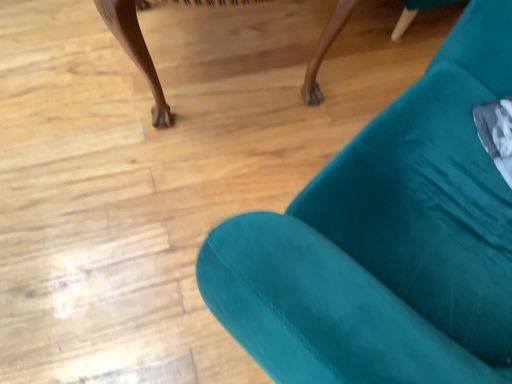
Question: Based on their sizes in the image, would you say velvet teal armchair at upper right is bigger or smaller than teal fabric chair at lower right?

Choices:
 (A) big
 (B) small

Answer: (A)

Question: Is velvet teal armchair at upper right in front of or behind teal fabric chair at lower right in the image?

Choices:
 (A) front
 (B) behind

Answer: (A)

Question: Is point (498, 345) closer or farther from the camera than point (160, 89)?

Choices:
 (A) farther
 (B) closer

Answer: (B)

Question: Considering the positions of teal fabric chair at lower right and velvet teal armchair at upper right in the image, is teal fabric chair at lower right wider or thinner than velvet teal armchair at upper right?

Choices:
 (A) thin
 (B) wide

Answer: (B)

Question: From a real-world perspective, is teal fabric chair at lower right positioned above or below velvet teal armchair at upper right?

Choices:
 (A) above
 (B) below

Answer: (B)

Question: From the image's perspective, relative to velvet teal armchair at upper right, is teal fabric chair at lower right above or below?

Choices:
 (A) below
 (B) above

Answer: (B)

Question: In terms of height, does teal fabric chair at lower right look taller or shorter compared to velvet teal armchair at upper right?

Choices:
 (A) short
 (B) tall

Answer: (A)